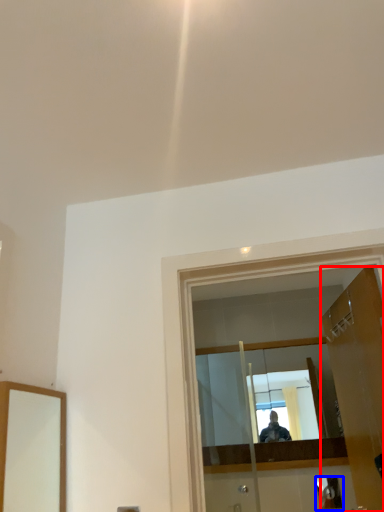
Question: Which object appears farthest to the camera in this image, door (highlighted by a red box) or reflection (highlighted by a blue box)?

Choices:
 (A) door
 (B) reflection

Answer: (B)